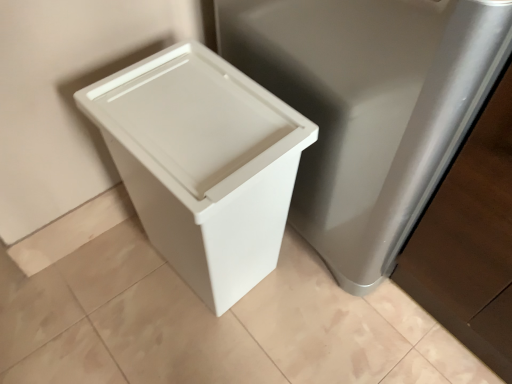
Question: Considering the positions of point (180, 122) and point (460, 168), is point (180, 122) closer or farther from the camera than point (460, 168)?

Choices:
 (A) farther
 (B) closer

Answer: (A)

Question: From the image's perspective, is white plastic waste container at left positioned above or below satin silver cabinet at right?

Choices:
 (A) below
 (B) above

Answer: (A)

Question: Which of these objects is positioned farthest from the beige wood baseboard at lower left?

Choices:
 (A) satin silver cabinet at right
 (B) white plastic waste container at left

Answer: (A)

Question: Which is nearer to the beige wood baseboard at lower left?

Choices:
 (A) satin silver cabinet at right
 (B) white plastic waste container at left

Answer: (B)